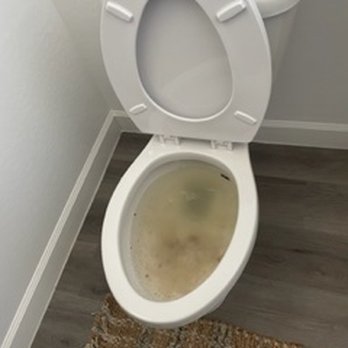
This screenshot has width=348, height=348. What are the coordinates of `corner of bathroom mat` in the screenshot? It's located at (207, 335).